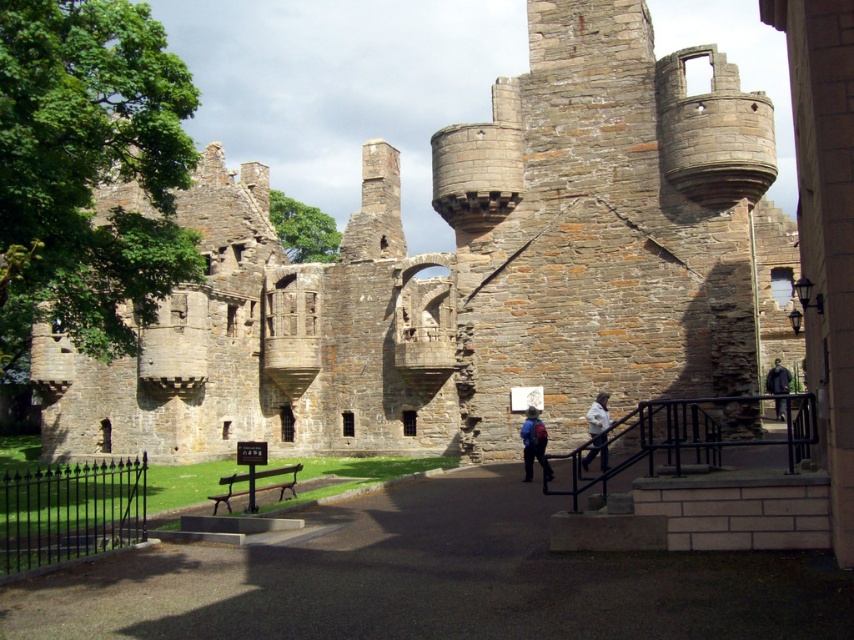
You are standing in front of the historic stone structure and notice a blue backpack at center and a white cotton jacket at lower center. Which object is taller?

The blue backpack at center is much taller than the white cotton jacket at lower center.

You are standing at the base of the historic stone structure and see two points marked on the ground. The first point is labeled as point [524,472] and the second as point [605,436]. From your perspective, which point is closer to you?

Point [605,436] is closer to you because it is in front of point [524,472], which is behind it.